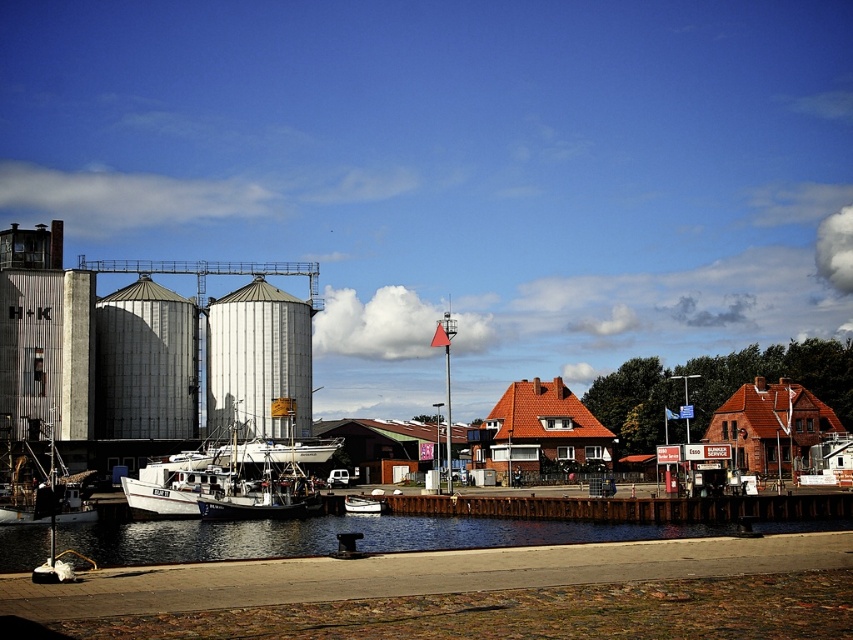
Question: Can you confirm if white metallic silo at center-left is bigger than brown wooden dock at center?

Choices:
 (A) yes
 (B) no

Answer: (A)

Question: Can you confirm if brown wooden dock at center is positioned above white wooden boat at center?

Choices:
 (A) no
 (B) yes

Answer: (B)

Question: Which is nearer to the white metallic silo at center-left?

Choices:
 (A) white matte boat at center
 (B) white wooden boat at center
 (C) brown wooden dock at center

Answer: (A)

Question: Which of these objects is positioned farthest from the white metallic silo at center-left?

Choices:
 (A) white wooden boat at center
 (B) white matte boat at center

Answer: (A)

Question: Can you confirm if white metallic silo at center-left is wider than white wooden boat at center?

Choices:
 (A) yes
 (B) no

Answer: (A)

Question: Which object is closer to the camera taking this photo?

Choices:
 (A) white matte boat at center
 (B) white wooden boat at center
 (C) white metallic silo at center-left
 (D) brown wooden dock at center

Answer: (D)